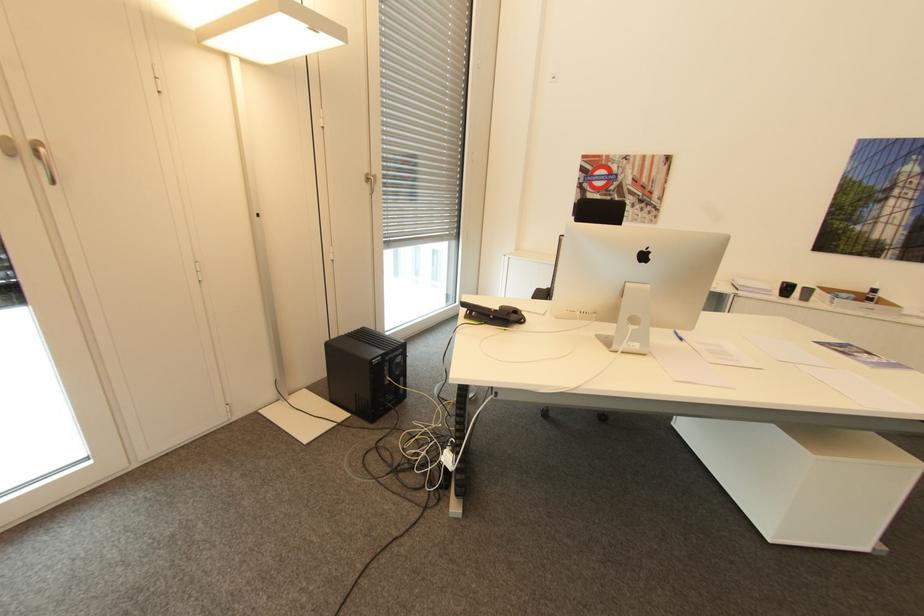
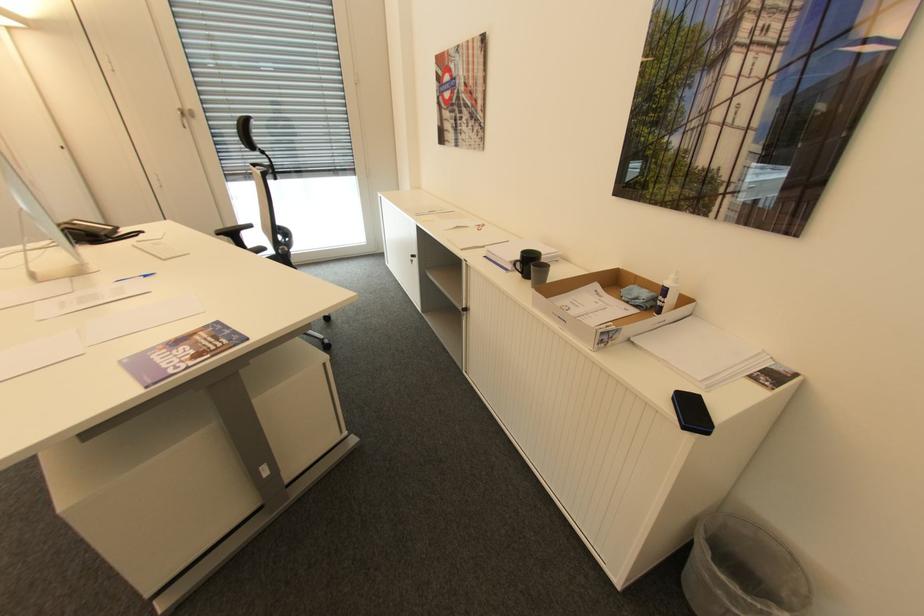
The point at [879,290] is marked in the first image. Where is the corresponding point in the second image?

(670, 291)